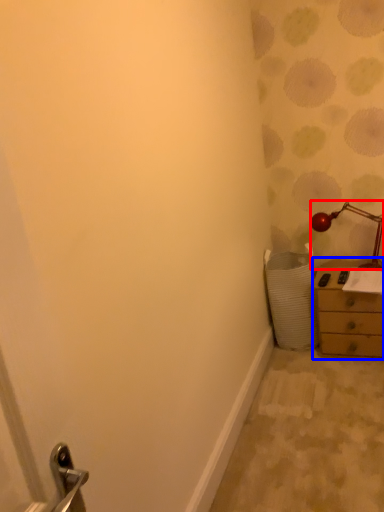
Question: Which object is further to the camera taking this photo, lamp (highlighted by a red box) or chest of drawers (highlighted by a blue box)?

Choices:
 (A) lamp
 (B) chest of drawers

Answer: (A)